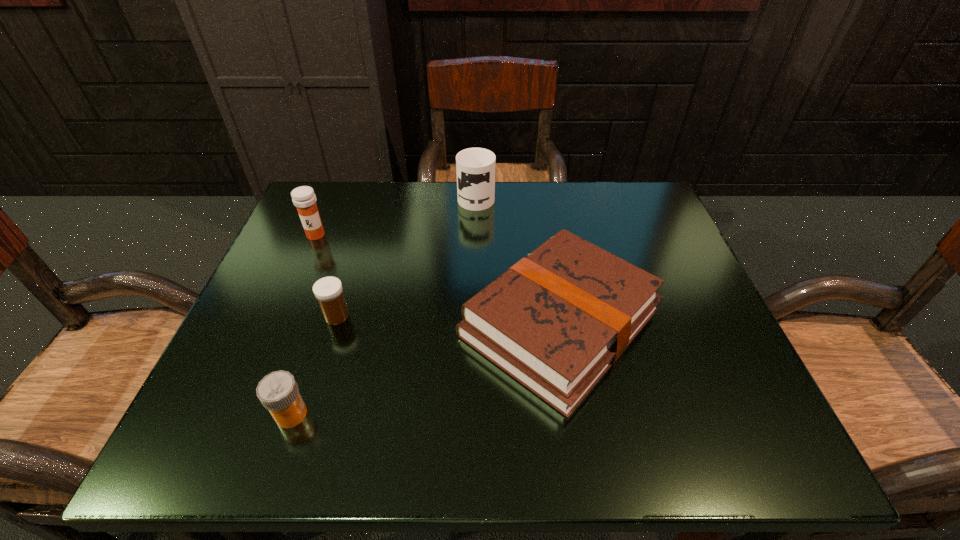
Image resolution: width=960 pixels, height=540 pixels. I want to click on free spot between the farthest object and the hardback book, so click(x=518, y=259).

Find the location of a particular element. empty space that is in between the second farthest medicine and the fourth nearest object is located at coordinates (326, 275).

I want to click on free space between the nearest medicine and the hardback book, so click(x=425, y=368).

You are a GUI agent. You are given a task and a screenshot of the screen. Output one action in this format:
    pyautogui.click(x=<x>, y=<y>)
    Task: Click on the free space between the second farthest medicine and the hardback book
    
    Given the screenshot: What is the action you would take?
    pyautogui.click(x=448, y=319)

The height and width of the screenshot is (540, 960). In order to click on the closest object to the nearest medicine in this screenshot , I will do `click(328, 291)`.

Identify the location of object that is the second closest one to the nearest medicine. The image size is (960, 540). (556, 321).

This screenshot has width=960, height=540. I want to click on medicine that stands as the closest to the hardback book, so coord(328,291).

At what (x,y) coordinates should I click in order to perform the action: click on medicine that can be found as the third closest to the hardback book. Please return your answer as a coordinate pair (x, y). The image size is (960, 540). Looking at the image, I should click on (303, 197).

Locate an element on the screen. The image size is (960, 540). vacant space that satisfies the following two spatial constraints: 1. on the front side of the hardback book; 2. on the label side of the nearest medicine is located at coordinates (575, 414).

Find the location of a particular element. Image resolution: width=960 pixels, height=540 pixels. free space that satisfies the following two spatial constraints: 1. on the label side of the second farthest medicine; 2. on the right side of the leftmost medicine is located at coordinates [281, 316].